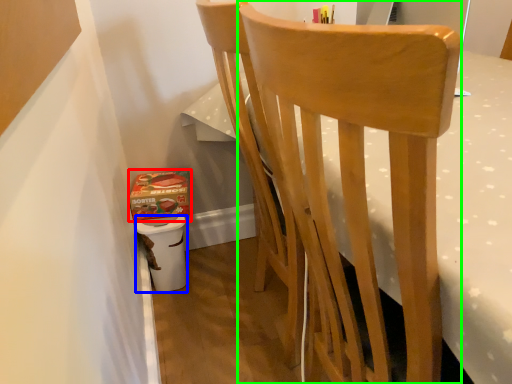
Question: Which is nearer to the box (highlighted by a red box)? potty (highlighted by a blue box) or chair (highlighted by a green box).

Choices:
 (A) potty
 (B) chair

Answer: (A)